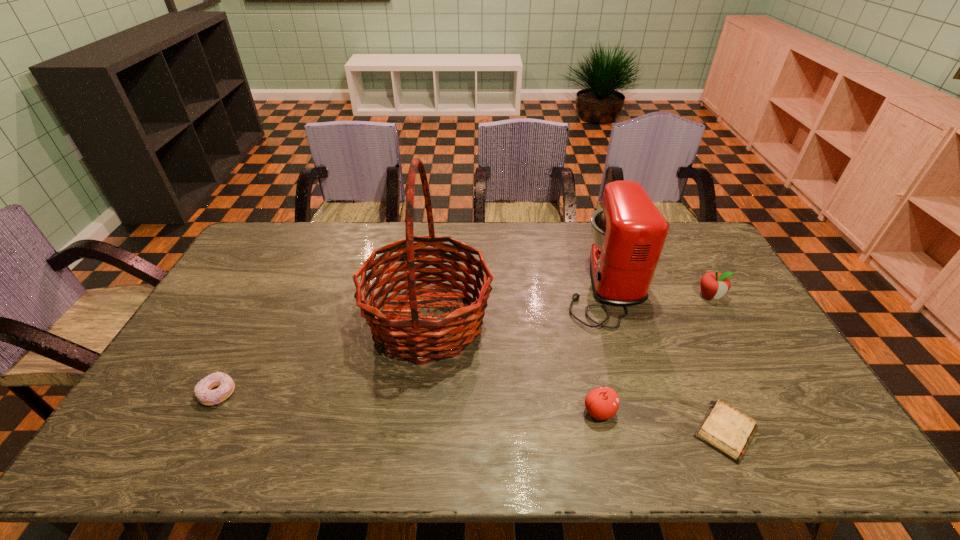
The height and width of the screenshot is (540, 960). I want to click on the fifth object from right to left, so click(420, 339).

What are the coordinates of `basket` in the screenshot? It's located at (420, 339).

Identify the location of the second tallest object. Image resolution: width=960 pixels, height=540 pixels. (629, 232).

Where is `the taller apple`? This screenshot has width=960, height=540. the taller apple is located at coordinates (715, 285).

I want to click on the farther apple, so click(715, 285).

The height and width of the screenshot is (540, 960). Identify the location of the left apple. (602, 403).

At what (x,y) coordinates should I click in order to perform the action: click on the nearer apple. Please return your answer as a coordinate pair (x, y). The width and height of the screenshot is (960, 540). Looking at the image, I should click on (602, 403).

Locate an element on the screen. the leftmost object is located at coordinates click(x=203, y=391).

Where is `doughnut`? doughnut is located at coordinates (203, 391).

Identify the location of diary. The image size is (960, 540). (727, 430).